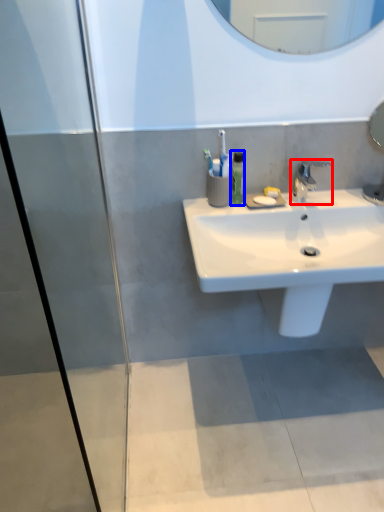
Question: Which of the following is the farthest to the observer, tap (highlighted by a red box) or soap dispenser (highlighted by a blue box)?

Choices:
 (A) tap
 (B) soap dispenser

Answer: (B)